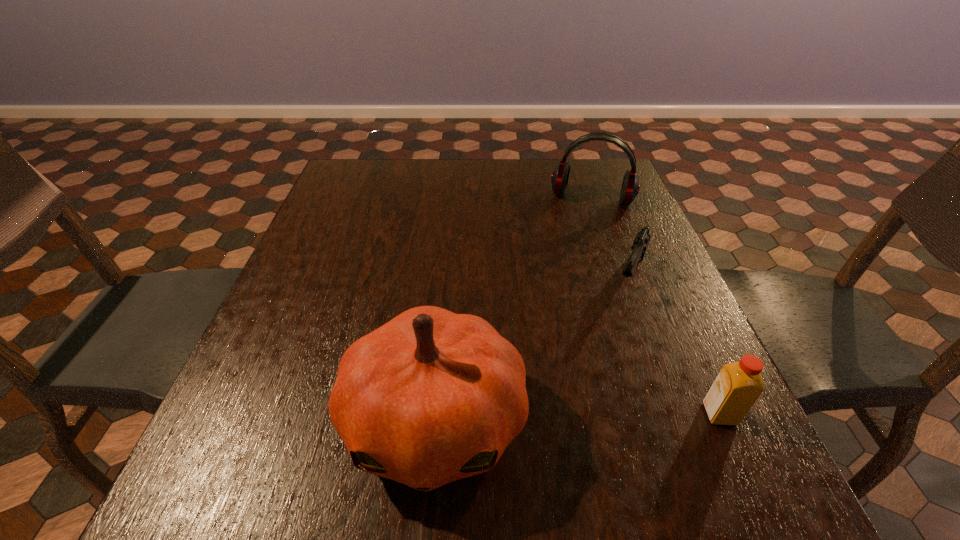
Where is `free spot between the leftmost object and the orange juice`? Image resolution: width=960 pixels, height=540 pixels. free spot between the leftmost object and the orange juice is located at coordinates (577, 417).

Image resolution: width=960 pixels, height=540 pixels. What are the coordinates of `free space between the tallest object and the orange juice` in the screenshot? It's located at (577, 417).

Find the location of a particular element. free point between the earphone and the second shortest object is located at coordinates (656, 306).

In order to click on empty location between the leftmost object and the orange juice in this screenshot , I will do `click(577, 417)`.

Locate an element on the screen. Image resolution: width=960 pixels, height=540 pixels. blank region between the earphone and the pumpkin is located at coordinates (514, 310).

Identify the location of empty space that is in between the pumpkin and the shortest object. The image size is (960, 540). (533, 349).

Locate an element on the screen. Image resolution: width=960 pixels, height=540 pixels. object that can be found as the third closest to the second shortest object is located at coordinates point(630,187).

Locate which object ranks in proximity to the pumpkin. Please provide its 2D coordinates. Your answer should be formatted as a tuple, i.e. [(x, y)], where the tuple contains the x and y coordinates of a point satisfying the conditions above.

[(642, 239)]

This screenshot has height=540, width=960. Find the location of `free spot that satisfies the following two spatial constraints: 1. on the front side of the earphone; 2. on the front and back of the orange juice`. free spot that satisfies the following two spatial constraints: 1. on the front side of the earphone; 2. on the front and back of the orange juice is located at coordinates (666, 414).

Find the location of a particular element. The width and height of the screenshot is (960, 540). vacant region that satisfies the following two spatial constraints: 1. on the front side of the orange juice; 2. on the front and back of the shortest object is located at coordinates (683, 414).